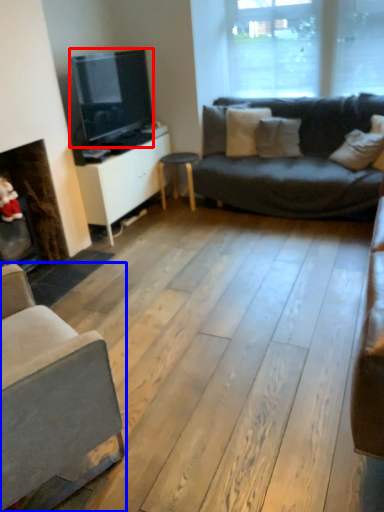
Question: Among these objects, which one is farthest to the camera, television (highlighted by a red box) or studio couch (highlighted by a blue box)?

Choices:
 (A) television
 (B) studio couch

Answer: (A)